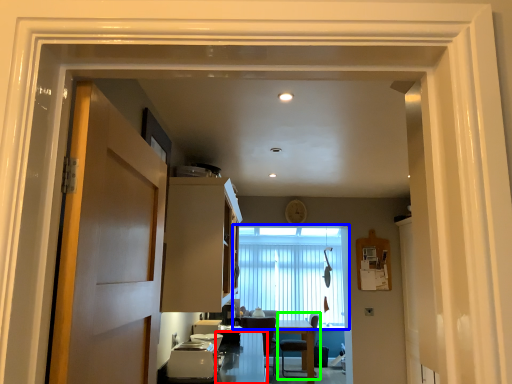
Question: Which object is the closest to the counter top (highlighted by a red box)? Choose among these: window (highlighted by a blue box) or chair (highlighted by a green box).

Choices:
 (A) window
 (B) chair

Answer: (A)